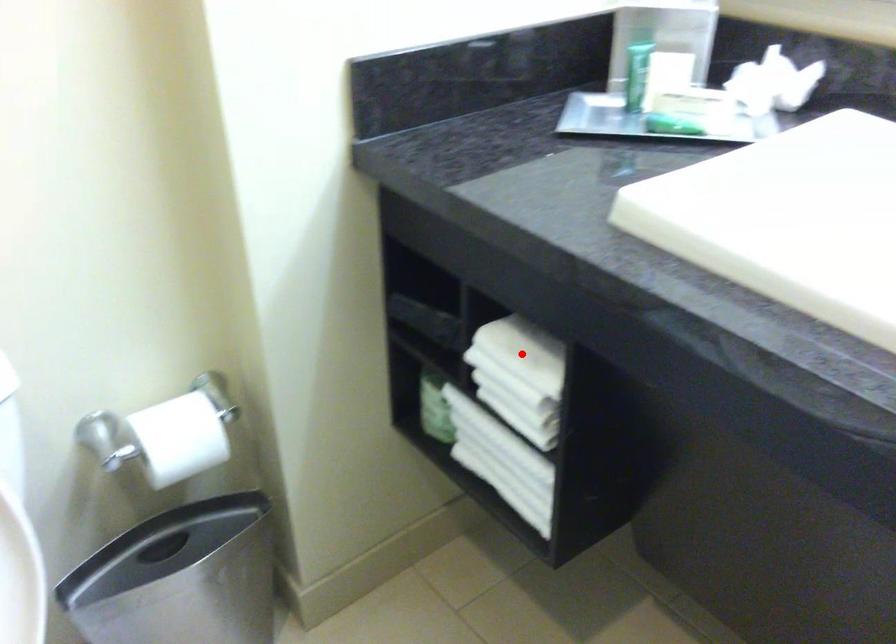
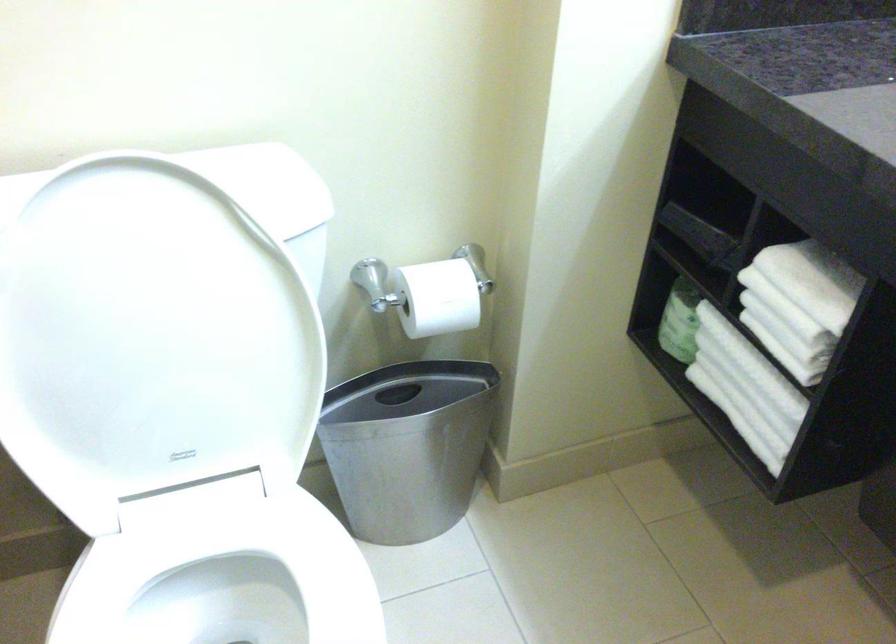
Find the pixel in the second image that matches the highlighted location in the first image.

(806, 281)